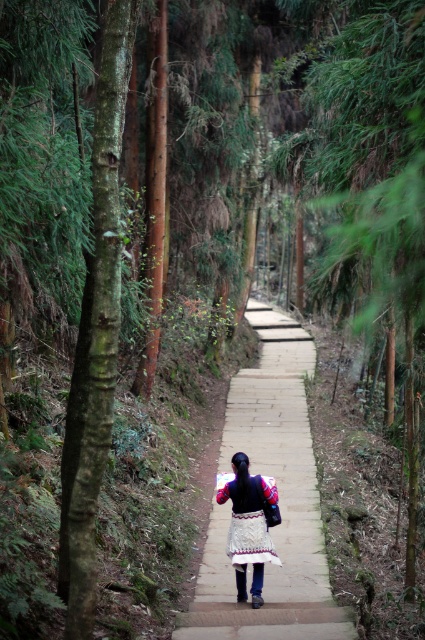
Is point (314, 611) positioned before point (246, 525)?

Yes, point (314, 611) is in front of point (246, 525).

Between smooth concrete path at center and white embroidered skirt at center, which one is positioned higher?

smooth concrete path at center is above.

Which is in front, point (229, 611) or point (275, 504)?

Point (229, 611) is more forward.

Find the location of a particular element. The height and width of the screenshot is (640, 425). smooth concrete path at center is located at coordinates (280, 500).

Does brown rough bark tree at left lie behind white embroidered skirt at center?

No, it is not.

The height and width of the screenshot is (640, 425). What do you see at coordinates (96, 332) in the screenshot?
I see `brown rough bark tree at left` at bounding box center [96, 332].

The image size is (425, 640). Identify the location of brown rough bark tree at left. (96, 332).

The height and width of the screenshot is (640, 425). Identify the location of brown rough bark tree at left. (96, 332).

Does smooth concrete path at center have a larger size compared to brown rough bark tree at left?

Yes.

Between smooth concrete path at center and brown rough bark tree at left, which one has more height?

Standing taller between the two is brown rough bark tree at left.

The height and width of the screenshot is (640, 425). What are the coordinates of `smooth concrete path at center` in the screenshot? It's located at (280, 500).